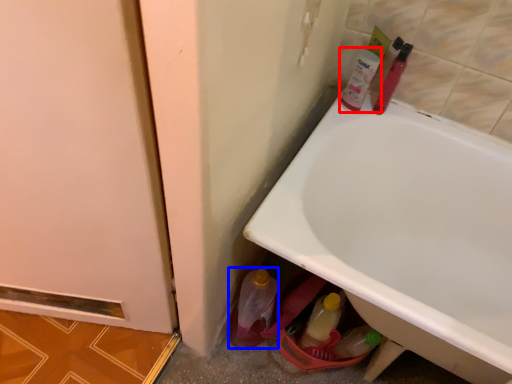
Question: Which object is closer to the camera taking this photo, mouthwash (highlighted by a red box) or bottle (highlighted by a blue box)?

Choices:
 (A) mouthwash
 (B) bottle

Answer: (B)